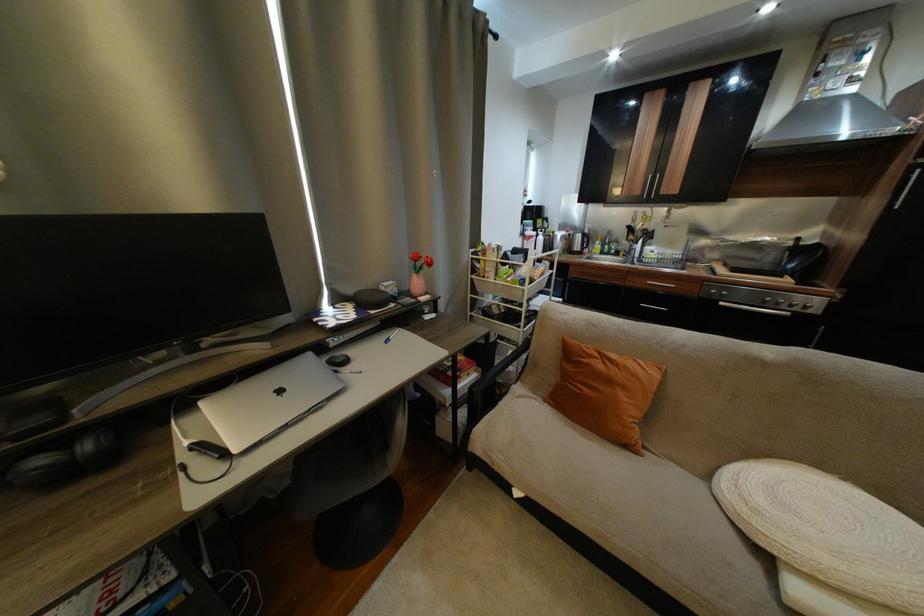
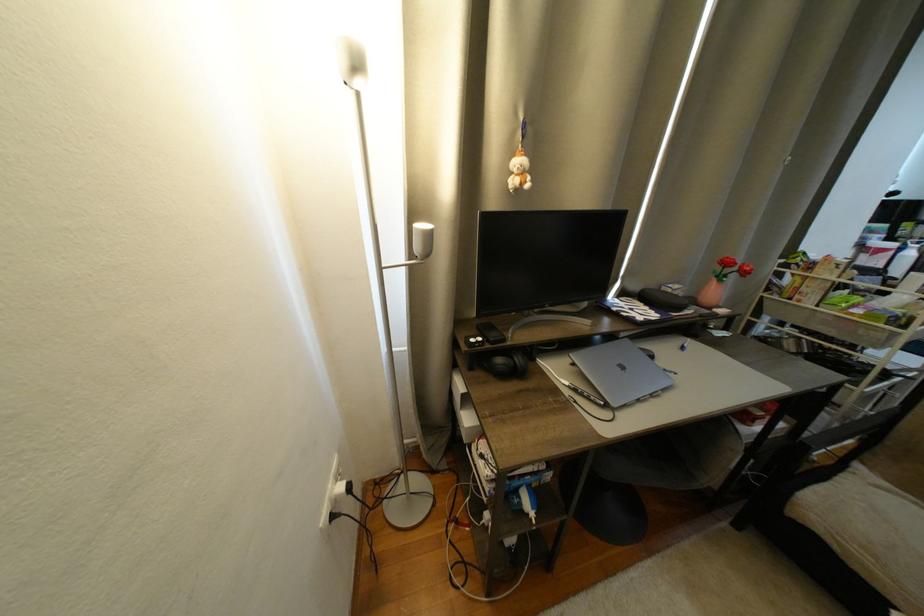
Find the pixel in the second image that matches the point at 363,294 in the first image.

(650, 292)